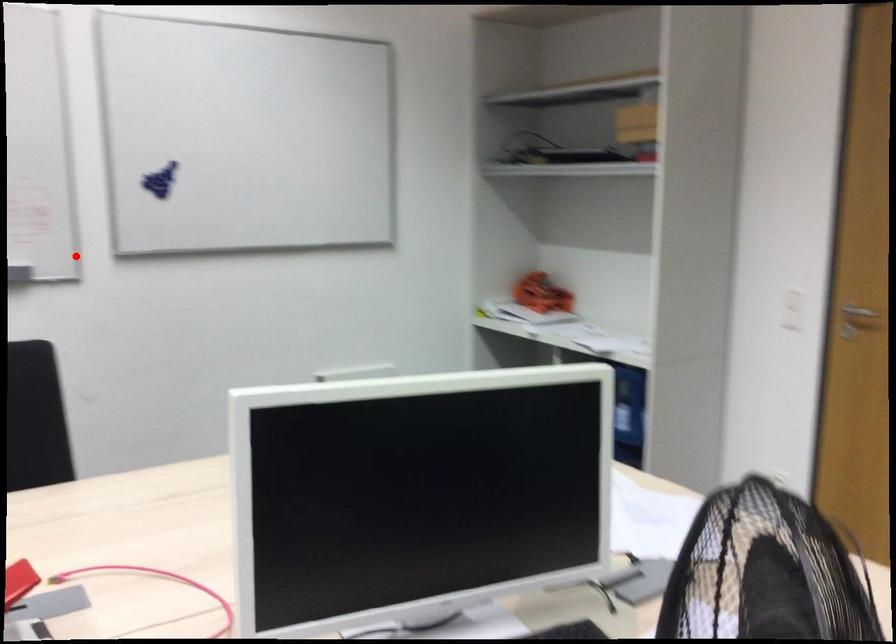
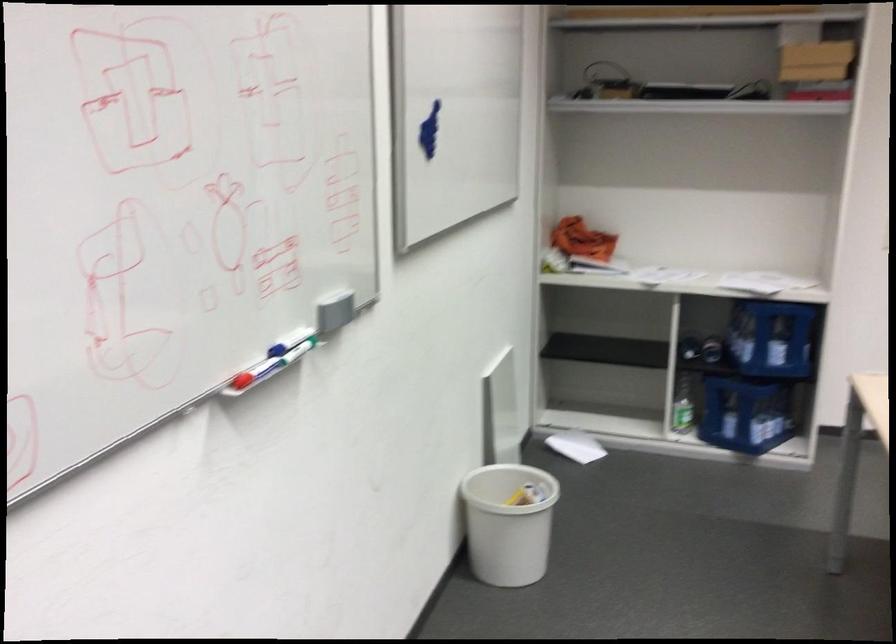
Question: A red point is marked in image1. In image2, is the corresponding 3D point closer to the camera or farther? Reply with the corresponding letter.

Choices:
 (A) The corresponding 3D point is closer.
 (B) The corresponding 3D point is farther.

Answer: (A)